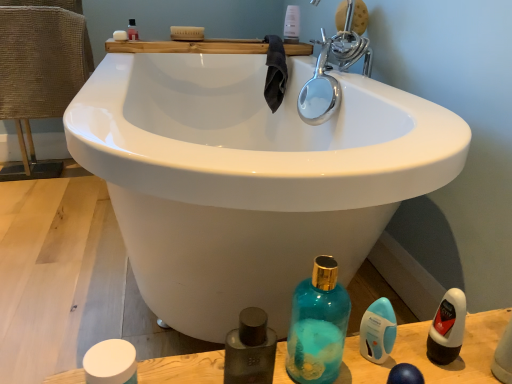
What do you see at coordinates (250, 349) in the screenshot? The height and width of the screenshot is (384, 512). I see `matte black bottle at lower center` at bounding box center [250, 349].

Describe the element at coordinates (39, 72) in the screenshot. Image resolution: width=512 pixels, height=384 pixels. I see `burlap-textured chair at left` at that location.

The image size is (512, 384). Describe the element at coordinates (111, 363) in the screenshot. I see `white matte jar at lower left, the first mouthwash when ordered from front to back` at that location.

At what (x,y) coordinates should I click in order to perform the action: click on translucent plastic bottle at upper center, the 2th toiletry positioned from the front. Please return your answer as a coordinate pair (x, y). The height and width of the screenshot is (384, 512). Looking at the image, I should click on pyautogui.click(x=292, y=24).

What do you see at coordinates (292, 24) in the screenshot? I see `translucent plastic bottle at upper center, the 1th toiletry from the back` at bounding box center [292, 24].

Measure the distance between teal glass bottle at lower center and camera.

A distance of 21.43 inches exists between teal glass bottle at lower center and camera.

Image resolution: width=512 pixels, height=384 pixels. I want to click on matte black bottle at lower center, so tap(250, 349).

Considering the positions of objects dark gray towel at upper center and burlap-textured chair at left in the image provided, who is in front, dark gray towel at upper center or burlap-textured chair at left?

dark gray towel at upper center is closer to the camera.

Consider the image. From a real-world perspective, between dark gray towel at upper center and burlap-textured chair at left, who is vertically higher?

In real-world perspective, dark gray towel at upper center is above.

Is dark gray towel at upper center facing away from burlap-textured chair at left?

dark gray towel at upper center is not turned away from burlap-textured chair at left.

Considering the sizes of objects matte black bottle at lower center and translucent plastic mouthwash at upper center, arranged as the third mouthwash when ordered from the bottom, in the image provided, who is taller, matte black bottle at lower center or translucent plastic mouthwash at upper center, arranged as the third mouthwash when ordered from the bottom,?

matte black bottle at lower center.

Does matte black bottle at lower center have a lesser width compared to translucent plastic mouthwash at upper center, placed as the first mouthwash when sorted from back to front?

In fact, matte black bottle at lower center might be wider than translucent plastic mouthwash at upper center, placed as the first mouthwash when sorted from back to front.

From the picture: Is matte black bottle at lower center oriented towards translucent plastic mouthwash at upper center, marked as the first mouthwash in a left-to-right arrangement?

No, matte black bottle at lower center does not turn towards translucent plastic mouthwash at upper center, marked as the first mouthwash in a left-to-right arrangement.

From a real-world perspective, relative to translucent plastic mouthwash at upper center, arranged as the third mouthwash when ordered from the bottom, is matte black bottle at lower center vertically above or below?

matte black bottle at lower center is below translucent plastic mouthwash at upper center, arranged as the third mouthwash when ordered from the bottom.

From the image's perspective, is blue translucent pump bottle at lower right, which is the first toiletry from bottom to top, located above white matte bottle at lower right, which appears as the second mouthwash when viewed from the front?

No, from the image's perspective, blue translucent pump bottle at lower right, which is the first toiletry from bottom to top, is not over white matte bottle at lower right, which appears as the second mouthwash when viewed from the front.

Could you tell me if blue translucent pump bottle at lower right, which appears as the second toiletry when viewed from the back, is facing white matte bottle at lower right, acting as the 3th mouthwash starting from the left?

No, blue translucent pump bottle at lower right, which appears as the second toiletry when viewed from the back, is not facing towards white matte bottle at lower right, acting as the 3th mouthwash starting from the left.

Looking at this image, is there a large distance between blue translucent pump bottle at lower right, which is the first toiletry from bottom to top, and white matte bottle at lower right, the second mouthwash when ordered from bottom to top?

No, blue translucent pump bottle at lower right, which is the first toiletry from bottom to top, is not far from white matte bottle at lower right, the second mouthwash when ordered from bottom to top.

In the scene shown: Which of these two, blue translucent pump bottle at lower right, which is the second toiletry from top to bottom, or white matte bottle at lower right, which appears as the second mouthwash when viewed from the front, stands shorter?

With less height is blue translucent pump bottle at lower right, which is the second toiletry from top to bottom.

Between blue translucent pump bottle at lower right, which appears as the second toiletry when viewed from the back, and burlap-textured chair at left, which one has more height?

burlap-textured chair at left.

Is blue translucent pump bottle at lower right, which is the second toiletry from top to bottom, to the right of burlap-textured chair at left from the viewer's perspective?

Yes, blue translucent pump bottle at lower right, which is the second toiletry from top to bottom, is to the right of burlap-textured chair at left.

The height and width of the screenshot is (384, 512). What are the coordinates of `chair on the left of blue translucent pump bottle at lower right, which is the second toiletry from top to bottom` in the screenshot? It's located at (39, 72).

Are dark gray towel at upper center and translucent plastic bottle at upper center, the 2th toiletry positioned from the front, far apart?

dark gray towel at upper center is near translucent plastic bottle at upper center, the 2th toiletry positioned from the front, not far away.

Does dark gray towel at upper center have a greater height compared to translucent plastic bottle at upper center, the 1th toiletry viewed from the top?

Yes.

Can you confirm if dark gray towel at upper center is thinner than translucent plastic bottle at upper center, the 1th toiletry viewed from the top?

In fact, dark gray towel at upper center might be wider than translucent plastic bottle at upper center, the 1th toiletry viewed from the top.

Is translucent plastic bottle at upper center, the 1th toiletry viewed from the top, surrounded by dark gray towel at upper center?

That's incorrect, translucent plastic bottle at upper center, the 1th toiletry viewed from the top, is not inside dark gray towel at upper center.

Is translucent plastic bottle at upper center, the 1th toiletry from the back, oriented towards blue translucent pump bottle at lower right, which appears as the second toiletry when viewed from the back?

No, translucent plastic bottle at upper center, the 1th toiletry from the back, is not turned towards blue translucent pump bottle at lower right, which appears as the second toiletry when viewed from the back.

Which is more to the left, translucent plastic bottle at upper center, which is the 2th toiletry from bottom to top, or blue translucent pump bottle at lower right, which appears as the second toiletry when viewed from the back?

translucent plastic bottle at upper center, which is the 2th toiletry from bottom to top, is more to the left.

Is point (297, 10) closer to camera compared to point (368, 326)?

No.

In the scene shown: Is teal glass bottle at lower center far away from blue translucent pump bottle at lower right, which appears as the second toiletry when viewed from the back?

No, there isn't a large distance between teal glass bottle at lower center and blue translucent pump bottle at lower right, which appears as the second toiletry when viewed from the back.

Is teal glass bottle at lower center not within blue translucent pump bottle at lower right, which appears as the second toiletry when viewed from the back?

Indeed, teal glass bottle at lower center is completely outside blue translucent pump bottle at lower right, which appears as the second toiletry when viewed from the back.

In the scene shown: Looking at the image, does teal glass bottle at lower center seem bigger or smaller compared to blue translucent pump bottle at lower right, which appears as the second toiletry when viewed from the back?

Clearly, teal glass bottle at lower center is larger in size than blue translucent pump bottle at lower right, which appears as the second toiletry when viewed from the back.

At what (x,y) coordinates should I click in order to perform the action: click on toiletry located below the teal glass bottle at lower center (from the image's perspective). Please return your answer as a coordinate pair (x, y). The height and width of the screenshot is (384, 512). Looking at the image, I should click on (378, 331).

You are a GUI agent. You are given a task and a screenshot of the screen. Output one action in this format:
    pyautogui.click(x=<x>, y=<y>)
    Task: Click on the material in front of the burlap-textured chair at left
    This screenshot has width=512, height=384.
    Given the screenshot: What is the action you would take?
    pyautogui.click(x=275, y=72)

Find the location of a particular element. This screenshot has width=512, height=384. cleaning product directly beneath the translucent plastic mouthwash at upper center, placed as the first mouthwash when sorted from back to front (from a real-world perspective) is located at coordinates (250, 349).

From the picture: Based on their spatial positions, is translucent plastic mouthwash at upper center, the 1th mouthwash viewed from the top, or white matte soap at upper left closer to matte black bottle at lower center?

Based on the image, white matte soap at upper left appears to be nearer to matte black bottle at lower center.

Which object lies nearer to the anchor point white matte bottle at lower right, which is counted as the second mouthwash, starting from the back, white matte jar at lower left, acting as the second mouthwash starting from the right, or blue translucent pump bottle at lower right, which appears as the second toiletry when viewed from the back?

blue translucent pump bottle at lower right, which appears as the second toiletry when viewed from the back, is positioned closer to the anchor white matte bottle at lower right, which is counted as the second mouthwash, starting from the back.

Based on their spatial positions, is dark gray towel at upper center or white matte bottle at lower right, which appears as the second mouthwash when viewed from the front, further from blue translucent pump bottle at lower right, which is the first toiletry from bottom to top?

dark gray towel at upper center is positioned further to the anchor blue translucent pump bottle at lower right, which is the first toiletry from bottom to top.

Considering their positions, is white matte jar at lower left, which is counted as the 2th mouthwash, starting from the left, positioned further to translucent plastic bottle at upper center, the 2th toiletry positioned from the front, than burlap-textured chair at left?

white matte jar at lower left, which is counted as the 2th mouthwash, starting from the left.

From the image, which object appears to be farther from burlap-textured chair at left, translucent plastic mouthwash at upper center, the third mouthwash in the front-to-back sequence, or white matte bottle at lower right, which appears as the second mouthwash when viewed from the top?

Among the two, white matte bottle at lower right, which appears as the second mouthwash when viewed from the top, is located further to burlap-textured chair at left.

When comparing their distances from white matte soap at upper left, does blue translucent pump bottle at lower right, which appears as the 1th toiletry when viewed from the front, or burlap-textured chair at left seem closer?

burlap-textured chair at left is closer to white matte soap at upper left.

Estimate the real-world distances between objects in this image. Which object is closer to burlap-textured chair at left, white matte jar at lower left, acting as the second mouthwash starting from the right, or white matte bottle at lower right, which appears as the second mouthwash when viewed from the top?

white matte jar at lower left, acting as the second mouthwash starting from the right, is positioned closer to the anchor burlap-textured chair at left.

Estimate the real-world distances between objects in this image. Which object is further from translucent plastic mouthwash at upper center, arranged as the third mouthwash when ordered from the bottom, dark gray towel at upper center or burlap-textured chair at left?

The object further to translucent plastic mouthwash at upper center, arranged as the third mouthwash when ordered from the bottom, is burlap-textured chair at left.

Identify the location of soap between white matte jar at lower left, the 3th mouthwash positioned from the top, and translucent plastic mouthwash at upper center, the third mouthwash in the front-to-back sequence, in the front-back direction. (120, 35).

Where is `soap between blue translucent pump bottle at lower right, which is the first toiletry from bottom to top, and translucent plastic bottle at upper center, the 2th toiletry positioned from the front, from front to back`? The height and width of the screenshot is (384, 512). soap between blue translucent pump bottle at lower right, which is the first toiletry from bottom to top, and translucent plastic bottle at upper center, the 2th toiletry positioned from the front, from front to back is located at coordinates tap(120, 35).

Where is `soap located between matte black bottle at lower center and burlap-textured chair at left in the depth direction`? Image resolution: width=512 pixels, height=384 pixels. soap located between matte black bottle at lower center and burlap-textured chair at left in the depth direction is located at coordinates (120, 35).

The image size is (512, 384). What are the coordinates of `toiletry between white matte bottle at lower right, which appears as the second mouthwash when viewed from the front, and white matte soap at upper left, along the z-axis` in the screenshot? It's located at (378, 331).